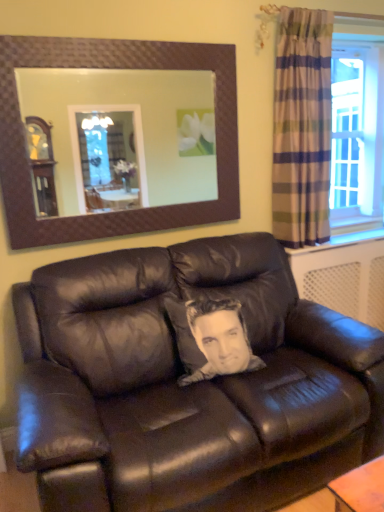
Question: Does brown textured mirror at upper center have a greater width compared to matte black leather couch at center?

Choices:
 (A) no
 (B) yes

Answer: (A)

Question: Is brown textured mirror at upper center taller than matte black leather couch at center?

Choices:
 (A) no
 (B) yes

Answer: (A)

Question: From a real-world perspective, is brown textured mirror at upper center under matte black leather couch at center?

Choices:
 (A) yes
 (B) no

Answer: (B)

Question: Can you confirm if brown textured mirror at upper center is smaller than matte black leather couch at center?

Choices:
 (A) no
 (B) yes

Answer: (B)

Question: Is brown textured mirror at upper center thinner than matte black leather couch at center?

Choices:
 (A) no
 (B) yes

Answer: (B)

Question: Does brown textured mirror at upper center appear on the right side of matte black leather couch at center?

Choices:
 (A) yes
 (B) no

Answer: (B)

Question: Does plaid fabric curtain at right have a lesser width compared to matte black leather couch at center?

Choices:
 (A) yes
 (B) no

Answer: (A)

Question: From the image's perspective, is plaid fabric curtain at right under matte black leather couch at center?

Choices:
 (A) yes
 (B) no

Answer: (B)

Question: Is plaid fabric curtain at right taller than matte black leather couch at center?

Choices:
 (A) no
 (B) yes

Answer: (B)

Question: Can you confirm if plaid fabric curtain at right is bigger than matte black leather couch at center?

Choices:
 (A) no
 (B) yes

Answer: (A)

Question: Is matte black leather couch at center at the back of plaid fabric curtain at right?

Choices:
 (A) no
 (B) yes

Answer: (A)

Question: Is plaid fabric curtain at right further to the viewer compared to matte black leather couch at center?

Choices:
 (A) yes
 (B) no

Answer: (A)

Question: Considering the relative positions of brown textured mirror at upper center and plaid fabric curtain at right in the image provided, is brown textured mirror at upper center behind plaid fabric curtain at right?

Choices:
 (A) no
 (B) yes

Answer: (A)